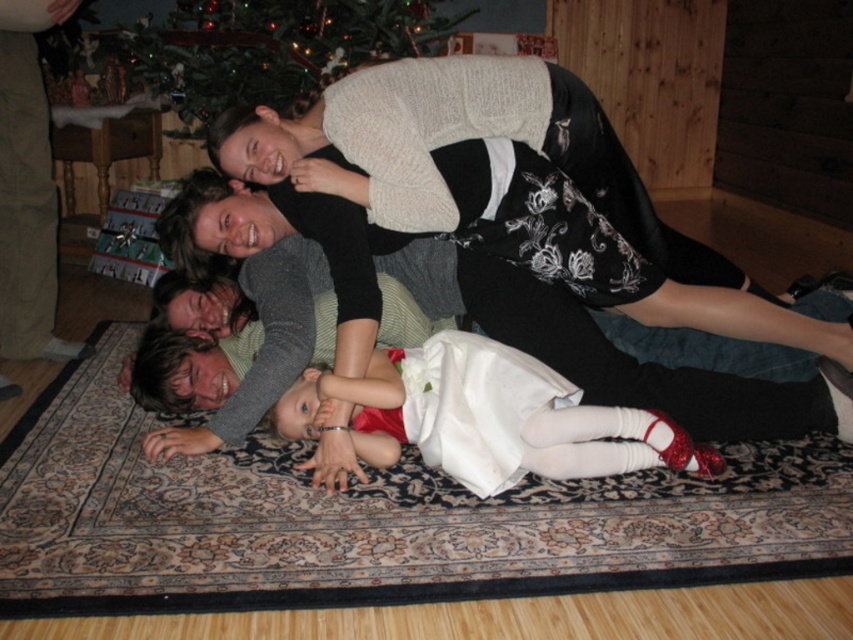
You are planning to rearrange the furniture in the living room. The black floral dress at upper center and the green matte christmas tree at upper center are both in the way of the new layout. Which object should you move first to free up more space?

The black floral dress at upper center occupies less space than the green matte christmas tree at upper center, so you should move the black floral dress at upper center first to free up more space.

You are a photographer trying to capture a family photo. You need to ensure that both the white satin dress at center and the green matte christmas tree at upper center are clearly visible in the frame. Given their sizes, which object will require more space in the composition?

The green matte christmas tree at upper center requires more space in the composition because it occupies more area than the white satin dress at center according to the description.

You are standing at the entrance of the room and want to find the white satin dress at center. According to the coordinates provided, in which direction should you look relative to the entrance?

The white satin dress at center is located at coordinates point (486, 417), which would be to the right and slightly forward from the entrance.